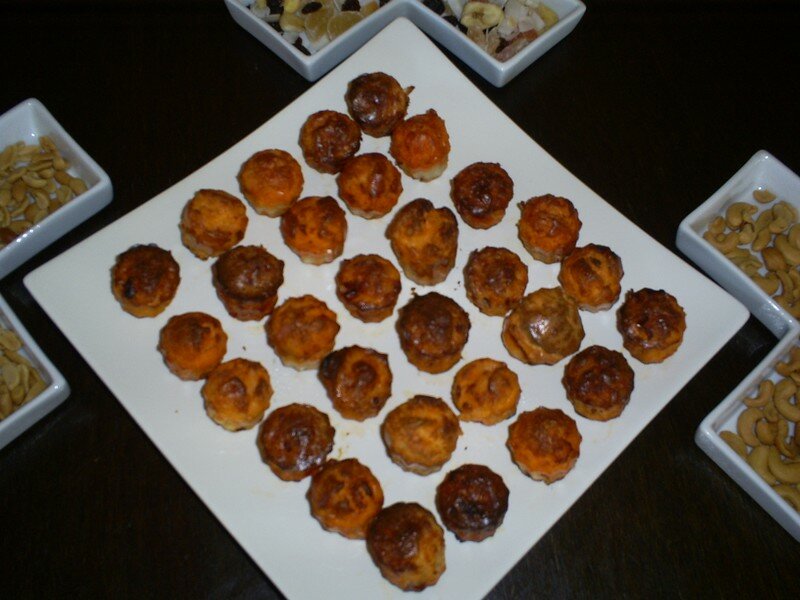
Where is `white serving surfaces`? The image size is (800, 600). white serving surfaces is located at coordinates (134, 365), (36, 236), (320, 59), (705, 437).